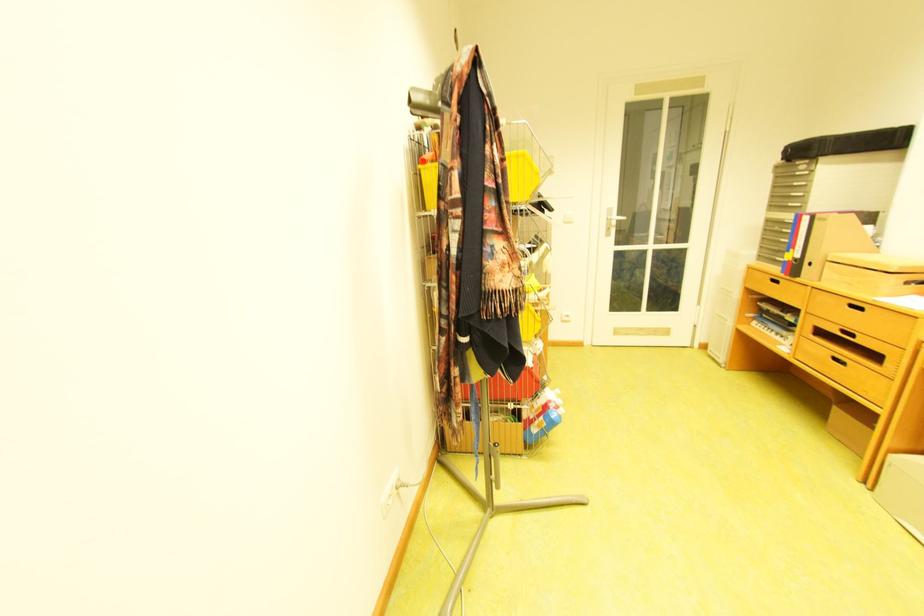
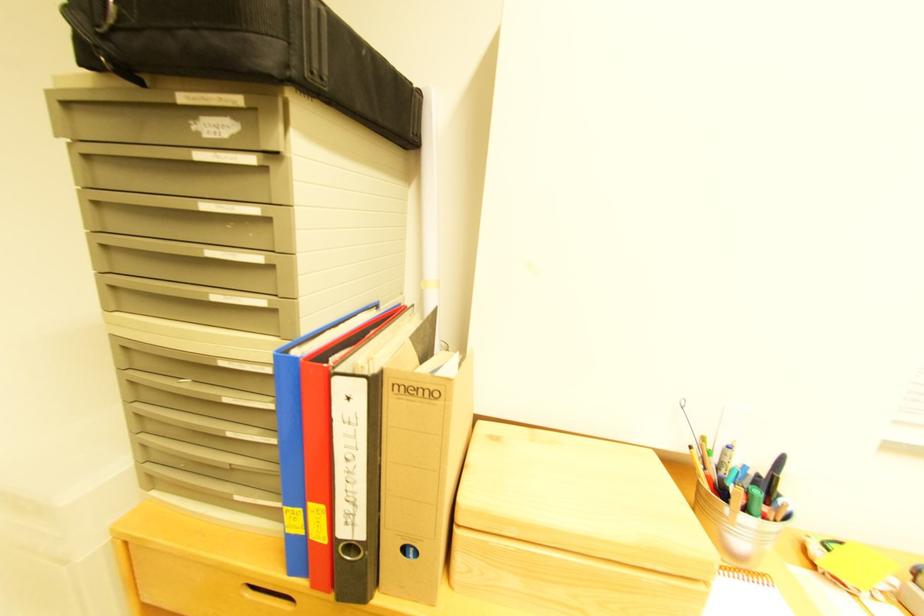
Find the pixel in the second image that matches point (815, 197) in the first image.

(282, 268)